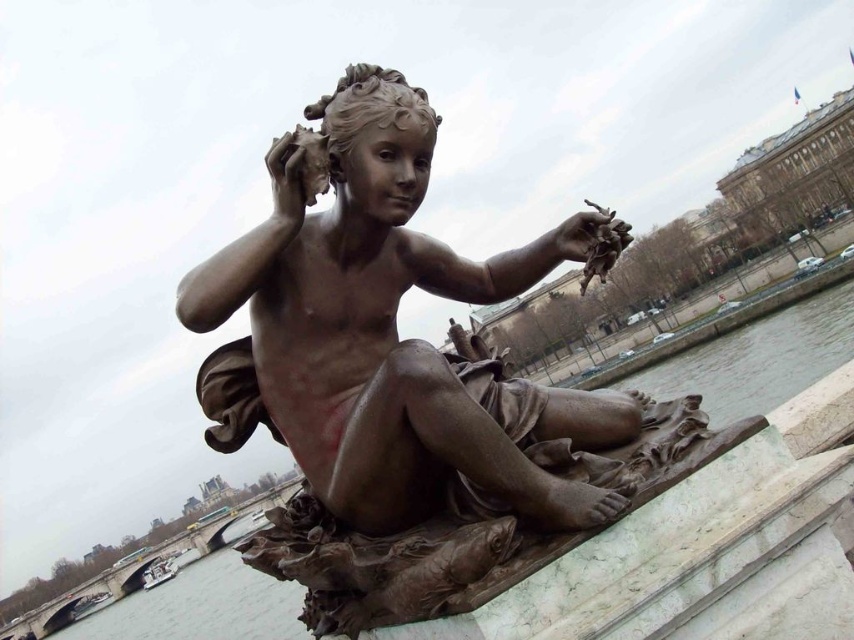
Between bronze statue at center and bronze water at statue center, which one is positioned lower?

bronze water at statue center is lower down.

Is bronze statue at center bigger than bronze water at statue center?

Incorrect, bronze statue at center is not larger than bronze water at statue center.

Does point (466, 458) lie in front of point (270, 584)?

Yes, it is in front of point (270, 584).

You are a GUI agent. You are given a task and a screenshot of the screen. Output one action in this format:
    pyautogui.click(x=<x>, y=<y>)
    Task: Click on the bronze statue at center
    
    Given the screenshot: What is the action you would take?
    pyautogui.click(x=385, y=332)